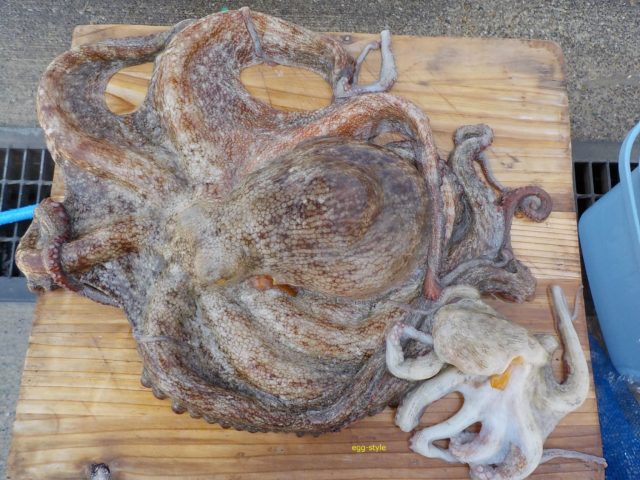
At what (x,y) coordinates should I click in order to perform the action: click on plastic bucket. Please return your answer as a coordinate pair (x, y). Looking at the image, I should click on (609, 249).